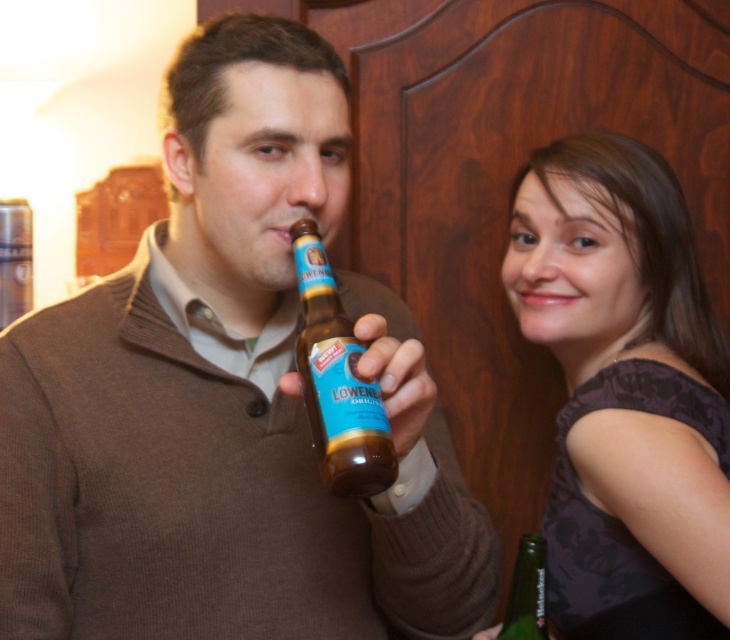
Does point (369, 499) lie in front of point (529, 566)?

Yes.

Based on the photo, is brown sweater at center further to camera compared to green glass bottle at lower right?

No, brown sweater at center is closer to the viewer.

Is point (119, 381) closer to camera compared to point (523, 568)?

No, it is behind (523, 568).

This screenshot has width=730, height=640. I want to click on brown sweater at center, so click(226, 400).

Is matte black dress at right above brown glass bottle at center?

Incorrect, matte black dress at right is not positioned above brown glass bottle at center.

Which is more to the right, matte black dress at right or brown glass bottle at center?

matte black dress at right

Where is `matte black dress at right`? The height and width of the screenshot is (640, 730). matte black dress at right is located at coordinates (626, 392).

Between brown sweater at center and matte black dress at right, which one appears on the right side from the viewer's perspective?

From the viewer's perspective, matte black dress at right appears more on the right side.

Is point (242, 624) farther from viewer compared to point (672, 458)?

No, (242, 624) is closer to viewer.

Is point (242, 33) closer to camera compared to point (564, 371)?

Yes.

The width and height of the screenshot is (730, 640). I want to click on brown sweater at center, so click(x=226, y=400).